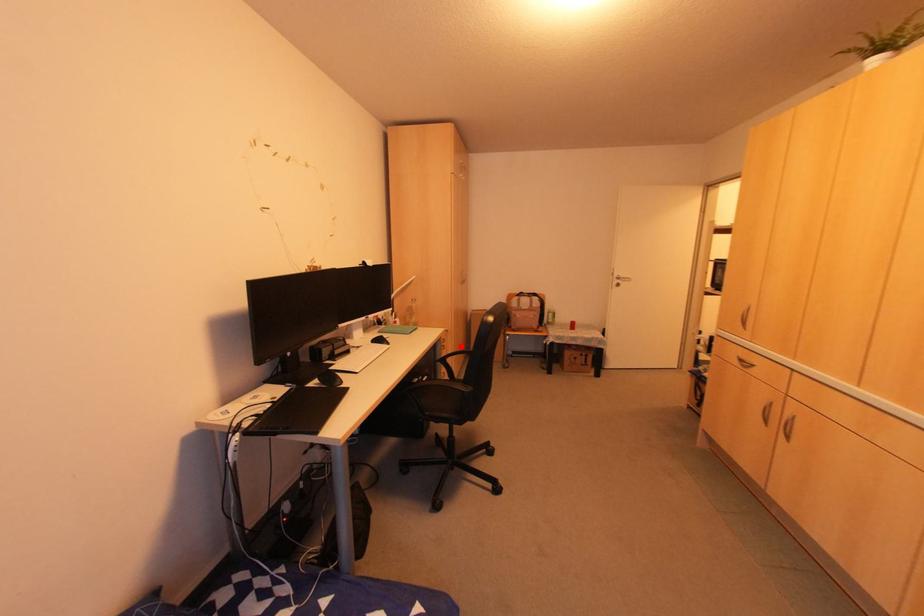
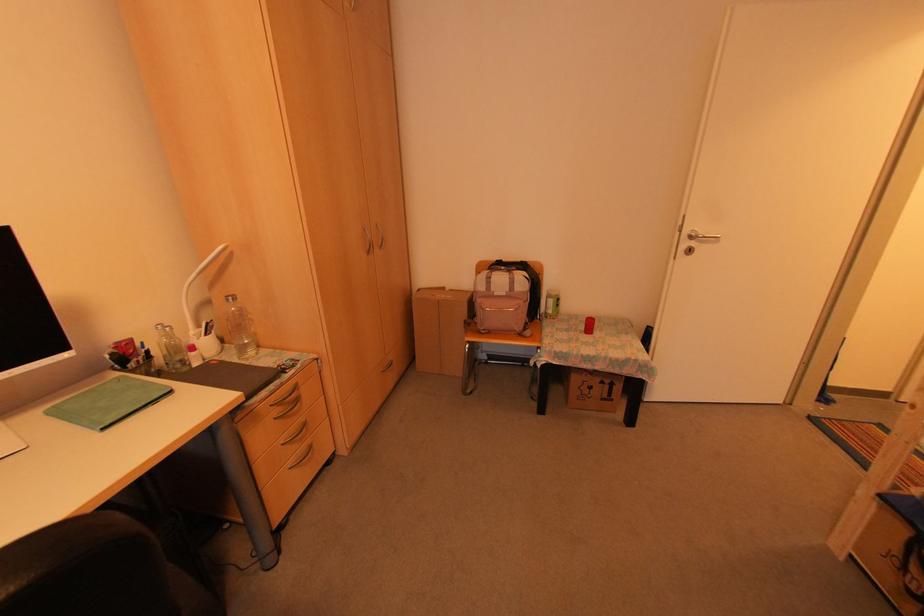
The point at the highlighted location is marked in the first image. Where is the corresponding point in the second image?

(388, 359)